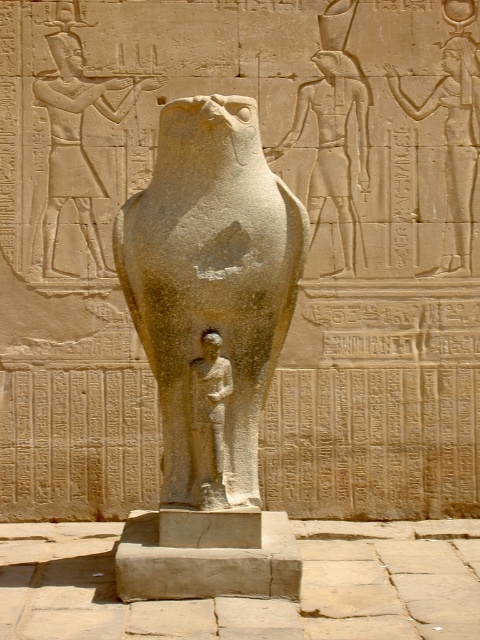
Can you confirm if gray stone statue at center is taller than sandstone relief figure at upper left?

Correct, gray stone statue at center is much taller as sandstone relief figure at upper left.

Does point (324, 76) come behind point (60, 116)?

Yes, it is behind point (60, 116).

Where is `gray stone statue at center`? This screenshot has height=640, width=480. gray stone statue at center is located at coordinates (334, 129).

At what (x,y) coordinates should I click in order to perform the action: click on gray stone statue at center. Please return your answer as a coordinate pair (x, y). This screenshot has width=480, height=640. Looking at the image, I should click on (334, 129).

Is the position of gray stone falcon at center more distant than that of gray stone statue at center?

No, it is in front of gray stone statue at center.

Is gray stone falcon at center smaller than gray stone statue at center?

Actually, gray stone falcon at center might be larger than gray stone statue at center.

What do you see at coordinates (211, 291) in the screenshot?
I see `gray stone falcon at center` at bounding box center [211, 291].

The height and width of the screenshot is (640, 480). What are the coordinates of `gray stone falcon at center` in the screenshot? It's located at (211, 291).

Is gray stone falcon at center to the right of sandstone relief figure at upper left from the viewer's perspective?

Indeed, gray stone falcon at center is positioned on the right side of sandstone relief figure at upper left.

Is point (216, 104) closer to camera compared to point (56, 136)?

That is True.

Where is `gray stone falcon at center`? gray stone falcon at center is located at coordinates (211, 291).

At what (x,y) coordinates should I click in order to perform the action: click on gray stone falcon at center. Please return your answer as a coordinate pair (x, y). Looking at the image, I should click on (211, 291).